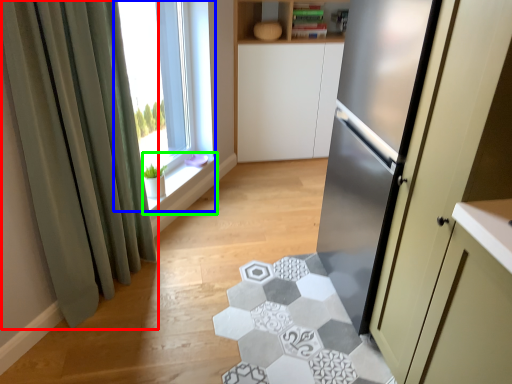
Question: Estimate the real-world distances between objects in this image. Which object is farther from curtain (highlighted by a red box), window (highlighted by a blue box) or window sill (highlighted by a green box)?

Choices:
 (A) window
 (B) window sill

Answer: (A)